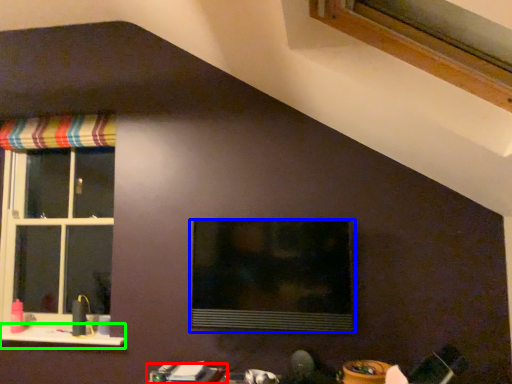
Question: Which object is the farthest from table (highlighted by a red box)? Choose among these: window (highlighted by a blue box) or window sill (highlighted by a green box).

Choices:
 (A) window
 (B) window sill

Answer: (B)